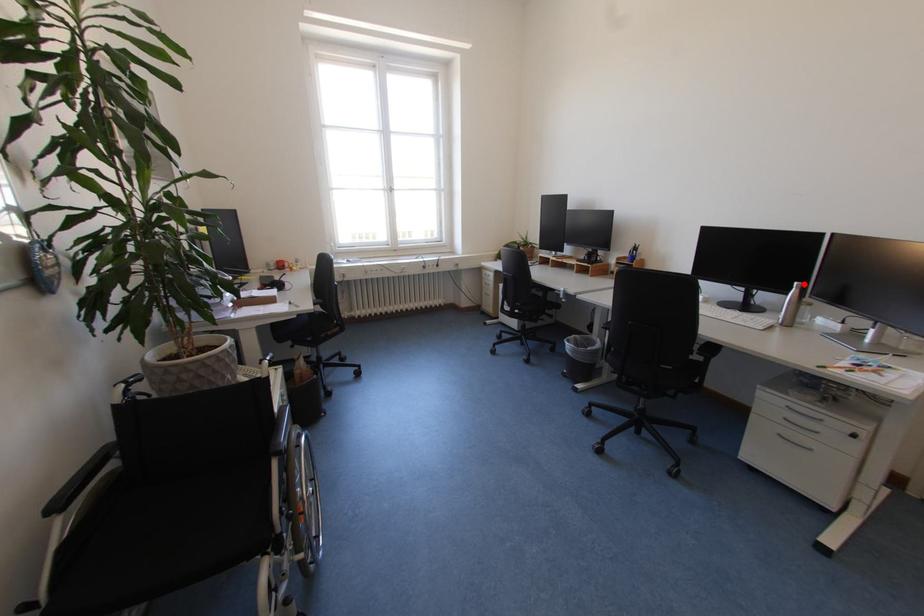
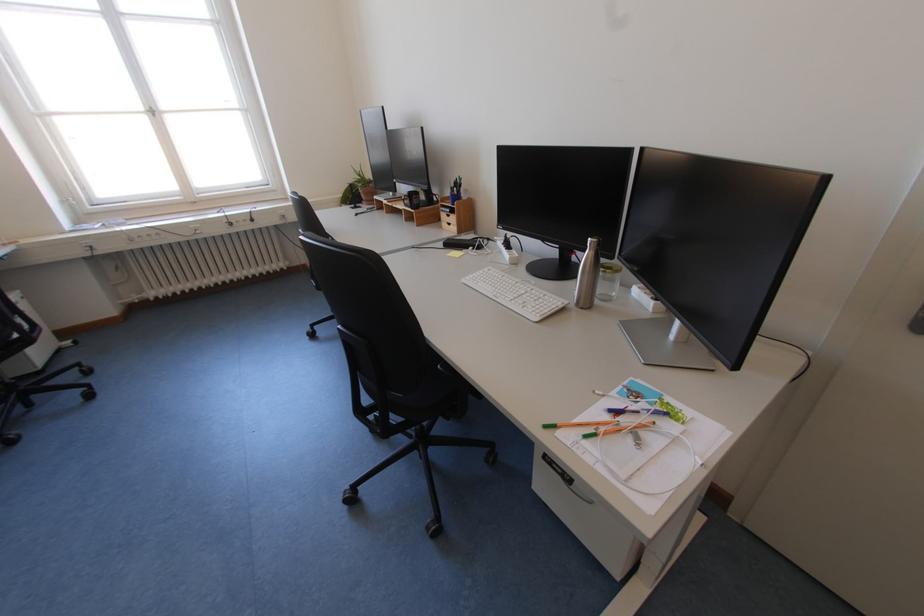
In the second image, find the point that corresponds to the highlighted location in the first image.

(599, 240)